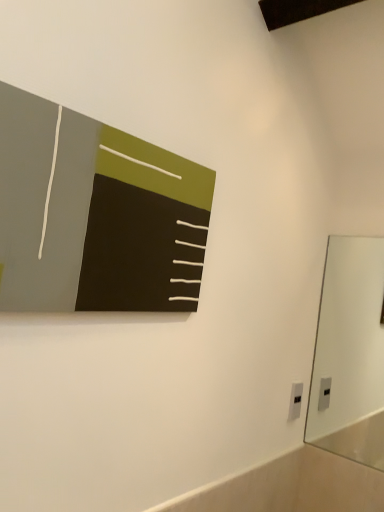
This screenshot has height=512, width=384. What do you see at coordinates (96, 215) in the screenshot?
I see `matte black board at upper left` at bounding box center [96, 215].

Identify the location of matte black board at upper left. click(x=96, y=215).

Locate an element on the screen. Image resolution: width=384 pixels, height=512 pixels. matte black board at upper left is located at coordinates (96, 215).